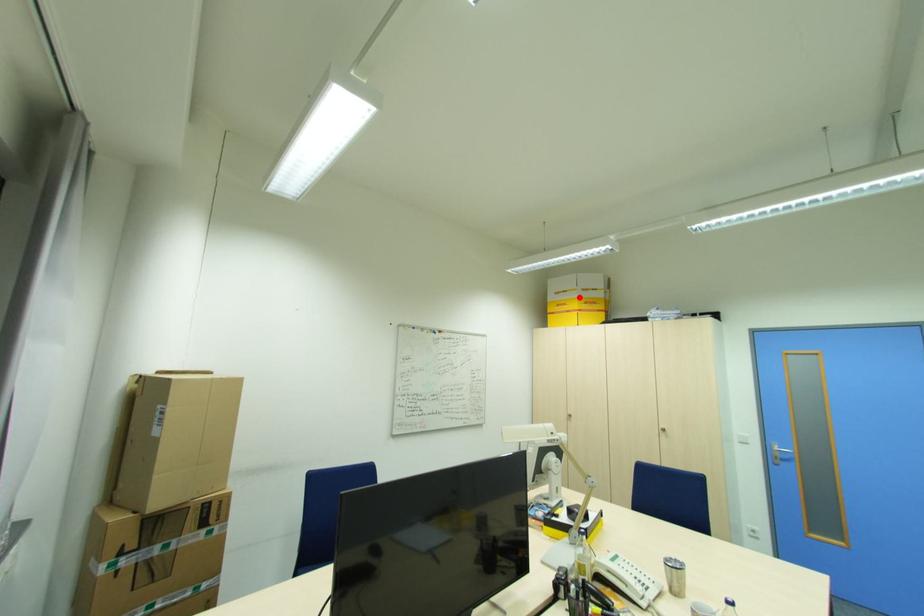
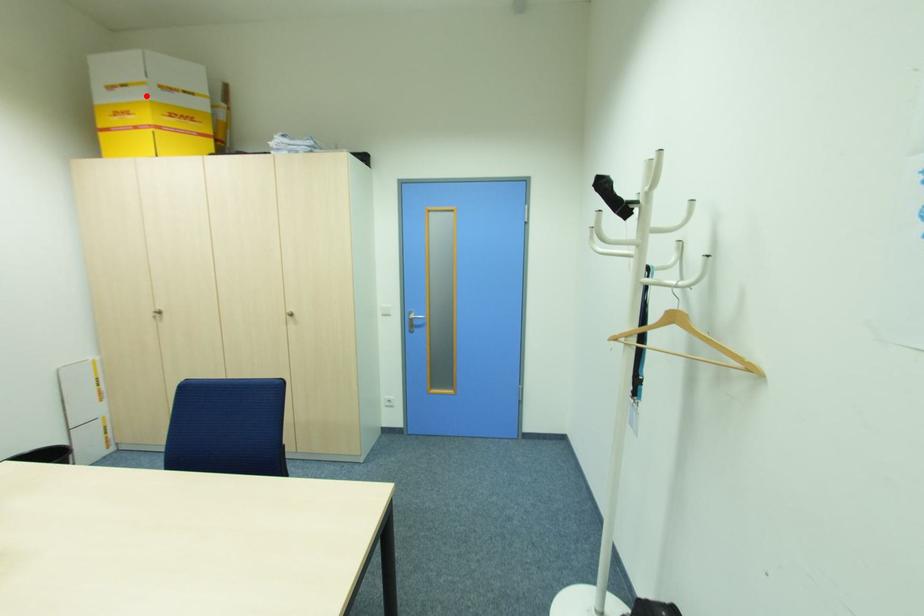
I am providing you with two images of the same scene from different viewpoints. A red point is marked on the first image and another point is marked on the second image. Do the highlighted points in image1 and image2 indicate the same real-world spot?

Yes